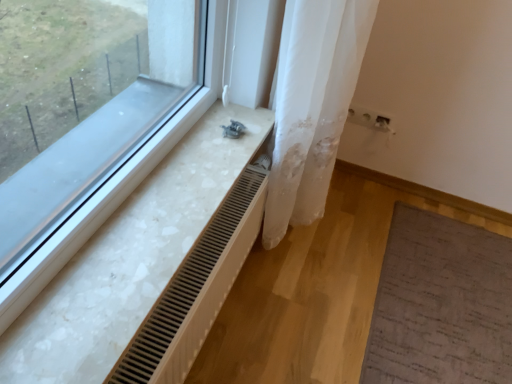
Identify the location of vacant region in front of white sheer fabric at center. (x=298, y=295).